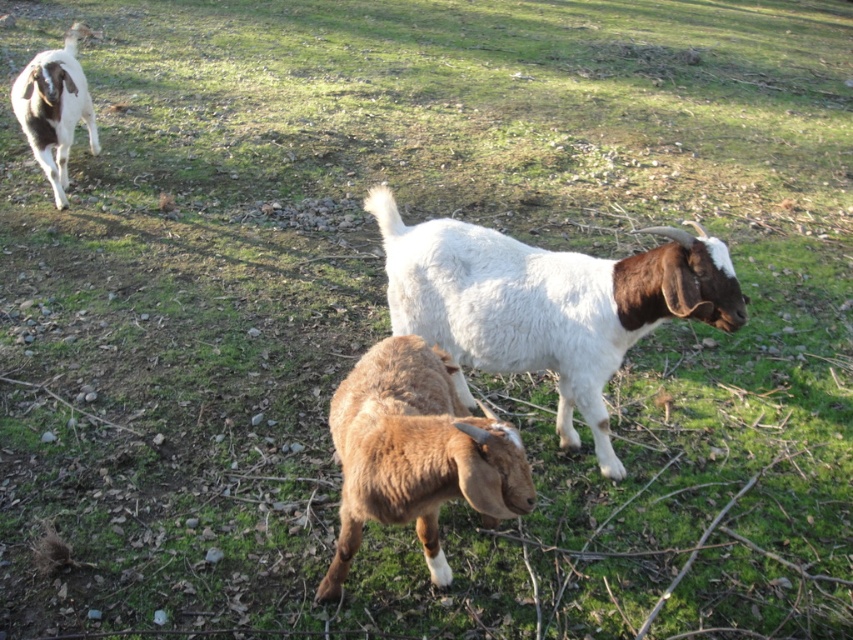
Question: Based on their relative distances, which object is nearer to the white woolen goat at center?

Choices:
 (A) brown fuzzy goat at center
 (B) brown woolen goat at upper left

Answer: (A)

Question: Based on their relative distances, which object is farther from the brown woolen goat at upper left?

Choices:
 (A) brown fuzzy goat at center
 (B) white woolen goat at center

Answer: (A)

Question: Can you confirm if white woolen goat at center is positioned above brown woolen goat at upper left?

Choices:
 (A) no
 (B) yes

Answer: (A)

Question: Among these points, which one is nearest to the camera?

Choices:
 (A) (399, 403)
 (B) (691, 257)
 (C) (20, 90)

Answer: (A)

Question: Is white woolen goat at center smaller than brown fuzzy goat at center?

Choices:
 (A) no
 (B) yes

Answer: (A)

Question: Is white woolen goat at center behind brown fuzzy goat at center?

Choices:
 (A) yes
 (B) no

Answer: (A)